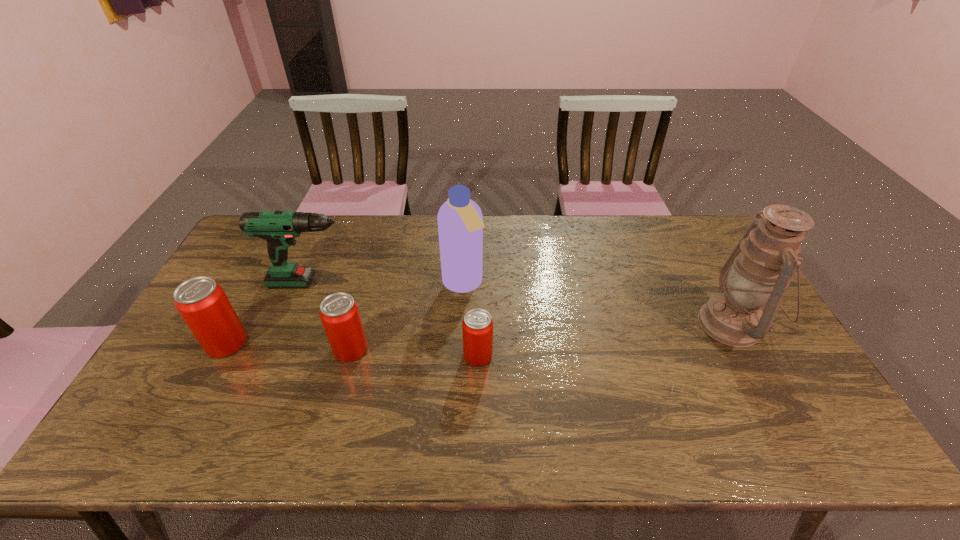
Where is `the leftmost can`? The image size is (960, 540). the leftmost can is located at coordinates (202, 303).

Find the location of a particular element. This screenshot has height=540, width=960. the fifth tallest object is located at coordinates (339, 313).

Find the location of a particular element. the second can from right to left is located at coordinates (339, 313).

This screenshot has height=540, width=960. I want to click on the shortest can, so click(477, 327).

Image resolution: width=960 pixels, height=540 pixels. I want to click on the shortest object, so click(477, 327).

You are a GUI agent. You are given a task and a screenshot of the screen. Output one action in this format:
    pyautogui.click(x=<x>, y=<y>)
    Task: Click on the drill
    
    Given the screenshot: What is the action you would take?
    pyautogui.click(x=279, y=228)

Locate an element on the screen. The height and width of the screenshot is (540, 960). the rightmost object is located at coordinates (759, 271).

Where is `shampoo`? The image size is (960, 540). shampoo is located at coordinates (460, 221).

This screenshot has height=540, width=960. I want to click on vacant space located on the right of the leftmost can, so click(x=358, y=343).

This screenshot has width=960, height=540. Identify the location of free spot located 0.160m on the left of the second can from left to right. (276, 349).